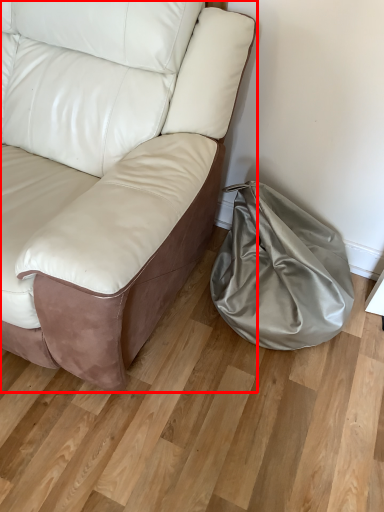
Question: From the image's perspective, considering the relative positions of studio couch (annotated by the red box) and bean bag chair in the image provided, where is studio couch (annotated by the red box) located with respect to the staircase?

Choices:
 (A) below
 (B) above

Answer: (B)